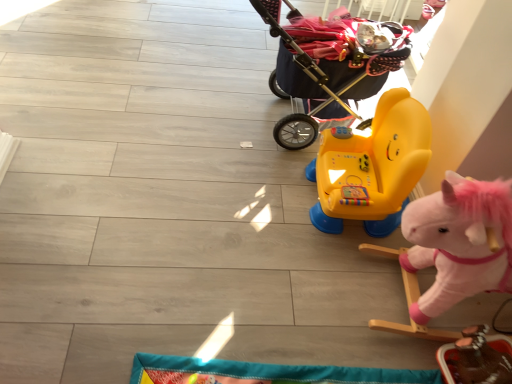
Identify the location of blank space to the left of yellow plastic ride-on toy at center, the 1th toy positioned from the top. (264, 196).